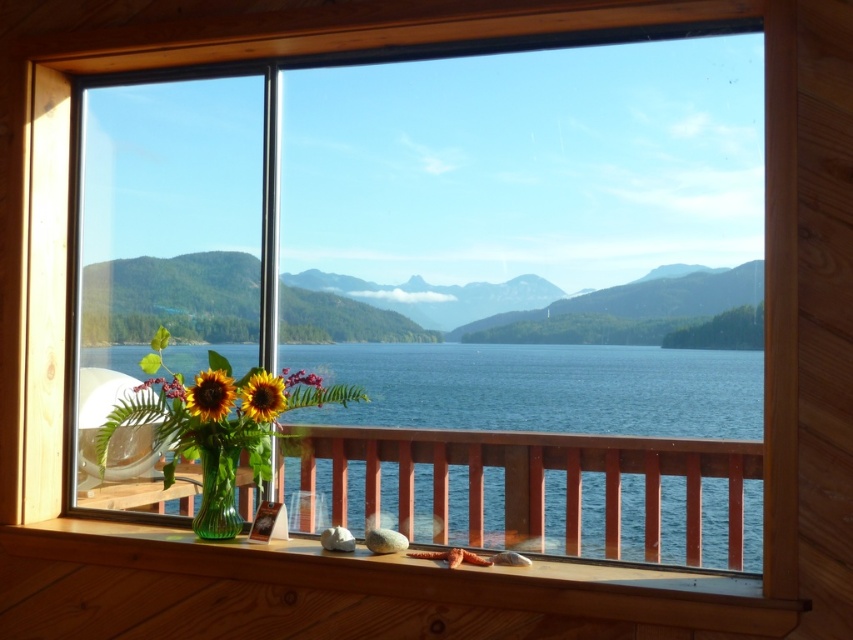
Question: Is green matte mountains at center further to camera compared to green glass vase at lower left?

Choices:
 (A) yes
 (B) no

Answer: (B)

Question: Which point appears closest to the camera in this image?

Choices:
 (A) (502, 536)
 (B) (225, 458)
 (C) (215, 372)
 (D) (161, 381)

Answer: (A)

Question: Which point appears farthest from the camera in this image?

Choices:
 (A) (251, 396)
 (B) (328, 296)
 (C) (223, 499)

Answer: (B)

Question: Can you confirm if sunflower matte at center is wider than sunflower matte at lower left?

Choices:
 (A) yes
 (B) no

Answer: (A)

Question: Which point is farther to the camera?

Choices:
 (A) green glass vase at lower left
 (B) sunflower matte at center

Answer: (A)

Question: Is transparent glass water at center thinner than matte glass sunflower at center?

Choices:
 (A) yes
 (B) no

Answer: (B)